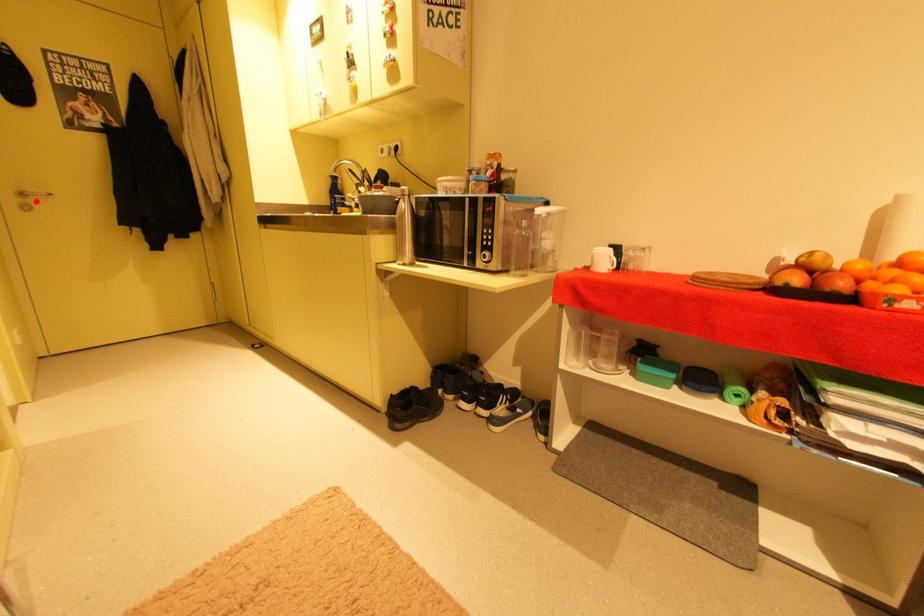
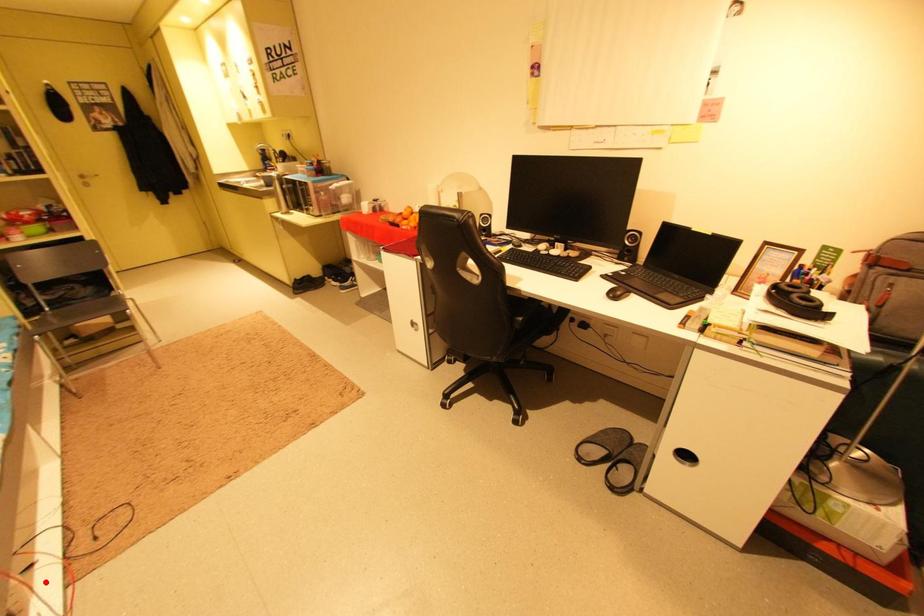
I am providing you with two images of the same scene from different viewpoints. A red point is marked on the first image and another point is marked on the second image. Does the point marked in image1 correspond to the same location as the one in image2?

No